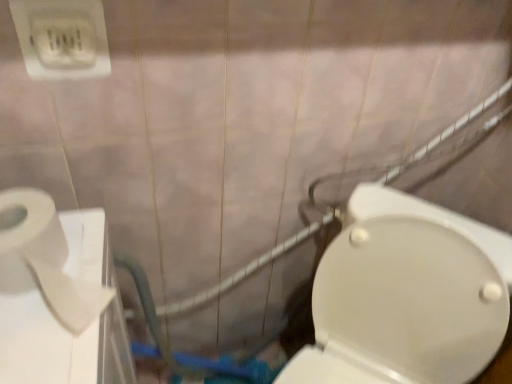
Question: Is white glossy toilet at center right positioned in front of white matte toilet paper at left?

Choices:
 (A) no
 (B) yes

Answer: (B)

Question: From a real-world perspective, is white glossy toilet at center right below white matte toilet paper at left?

Choices:
 (A) yes
 (B) no

Answer: (A)

Question: Can you confirm if white glossy toilet at center right is taller than white matte toilet paper at left?

Choices:
 (A) yes
 (B) no

Answer: (A)

Question: Can you confirm if white glossy toilet at center right is positioned to the left of white matte toilet paper at left?

Choices:
 (A) yes
 (B) no

Answer: (B)

Question: Could white matte toilet paper at left be considered to be inside white glossy toilet at center right?

Choices:
 (A) yes
 (B) no

Answer: (B)

Question: Is white glossy toilet at center right wider or thinner than white matte toilet paper at left?

Choices:
 (A) thin
 (B) wide

Answer: (B)

Question: From the image's perspective, is white glossy toilet at center right positioned above or below white matte toilet paper at left?

Choices:
 (A) below
 (B) above

Answer: (A)

Question: Based on their sizes in the image, would you say white glossy toilet at center right is bigger or smaller than white matte toilet paper at left?

Choices:
 (A) big
 (B) small

Answer: (A)

Question: Considering the positions of white glossy toilet at center right and white matte toilet paper at left in the image, is white glossy toilet at center right taller or shorter than white matte toilet paper at left?

Choices:
 (A) tall
 (B) short

Answer: (A)

Question: Is white plastic outlet at upper left in front of or behind white glossy toilet at center right in the image?

Choices:
 (A) front
 (B) behind

Answer: (B)

Question: From a real-world perspective, is white plastic outlet at upper left physically located above or below white glossy toilet at center right?

Choices:
 (A) above
 (B) below

Answer: (A)

Question: Is white plastic outlet at upper left spatially inside white glossy toilet at center right, or outside of it?

Choices:
 (A) outside
 (B) inside

Answer: (A)

Question: Looking at the image, does white plastic outlet at upper left seem bigger or smaller compared to white glossy toilet at center right?

Choices:
 (A) big
 (B) small

Answer: (B)

Question: In the image, is white plastic outlet at upper left on the left side or the right side of white matte toilet paper at left?

Choices:
 (A) left
 (B) right

Answer: (A)

Question: From their relative heights in the image, would you say white plastic outlet at upper left is taller or shorter than white matte toilet paper at left?

Choices:
 (A) short
 (B) tall

Answer: (B)